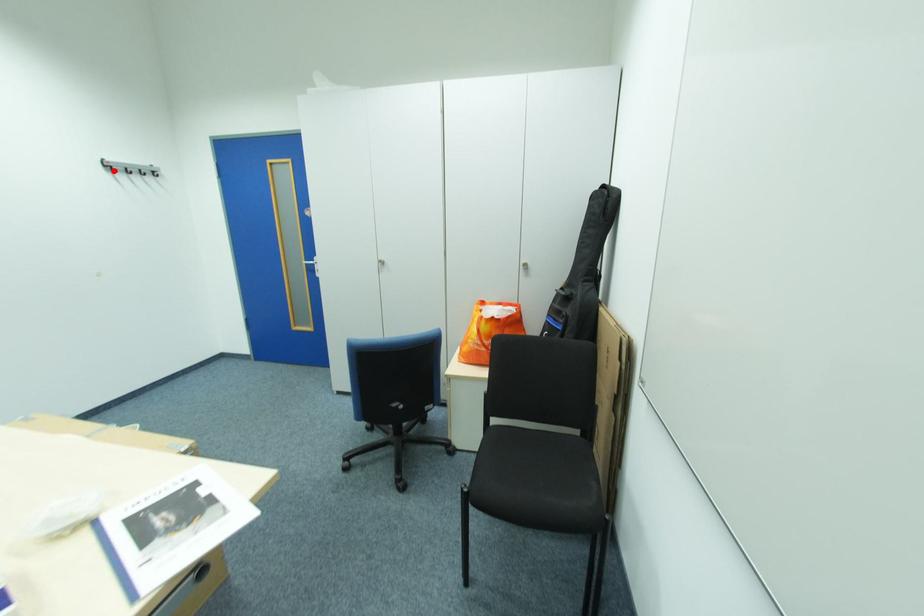
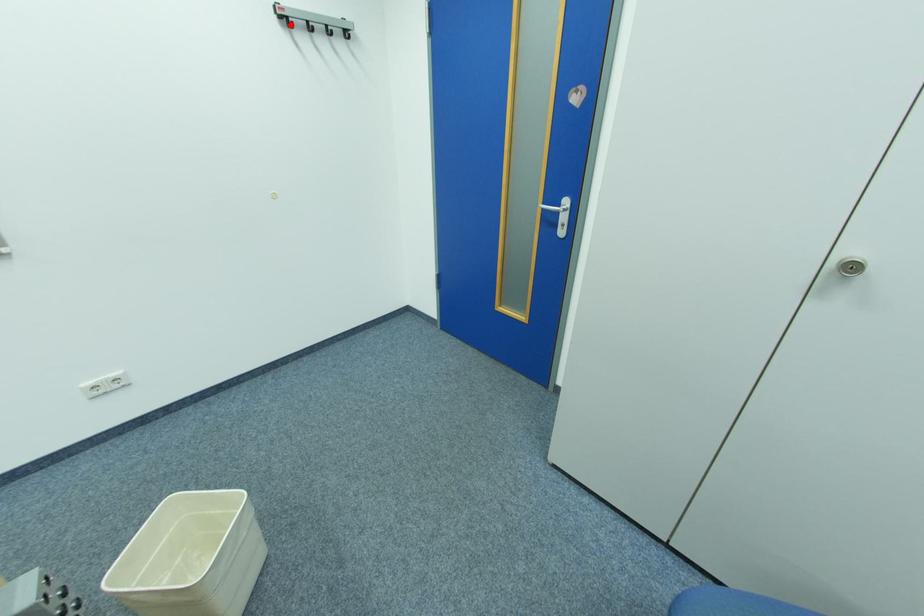
I am providing you with two images of the same scene from different viewpoints. A red point is marked on the first image and another point is marked on the second image. Are the points marked in image1 and image2 representing the same 3D position?

Yes